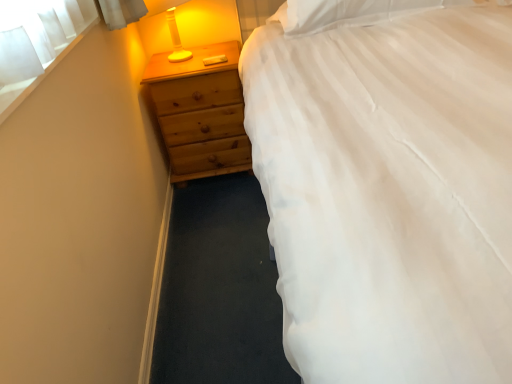
Question: From a real-world perspective, is white soft pillow at upper right physically located above or below white fabric at upper left?

Choices:
 (A) above
 (B) below

Answer: (B)

Question: Is white soft pillow at upper right to the left or to the right of white fabric at upper left in the image?

Choices:
 (A) right
 (B) left

Answer: (A)

Question: Which object is positioned closest to the white fabric at upper left?

Choices:
 (A) white soft pillow at upper right
 (B) wooden chest of drawers at left

Answer: (B)

Question: Based on their relative distances, which object is farther from the white soft pillow at upper right?

Choices:
 (A) wooden chest of drawers at left
 (B) white fabric at upper left

Answer: (B)